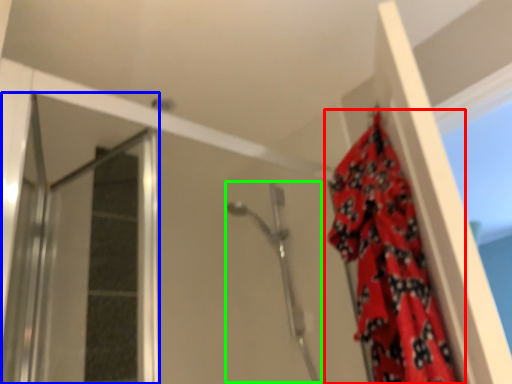
Question: Based on their relative distances, which object is farther from curtain (highlighted by a red box)? Choose from screen door (highlighted by a blue box) and shower (highlighted by a green box).

Choices:
 (A) screen door
 (B) shower

Answer: (A)